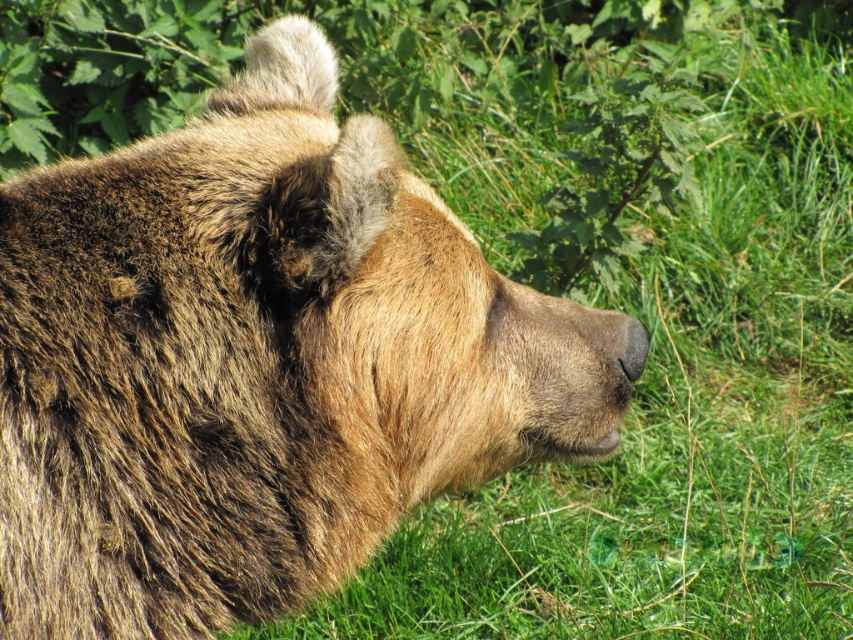
You are a photographer aiming to capture the bear in the scene. You want to ensure that both the green leafy plant at upper center and the black fur nose at center are visible in your shot. Based on their positions, which object should you position first in your camera frame to include both?

The green leafy plant at upper center is to the right of the black fur nose at center, so you should position the black fur nose at center first on the left side of the frame to ensure the green leafy plant at upper center fits on the right.

You are a wildlife photographer aiming to capture a close shot of the fuzzy brown bear at center. If your camera has a focus point at the center of the image, which is at coordinate point 0.5, 0.5, will the bear be in focus?

The fuzzy brown bear at center is located at point (257, 362), which is slightly to the right and above the camera focus point at (426, 320). Therefore, the bear will not be perfectly centered in the frame, so it may not be in focus unless the focus point is adjusted.

Based on the scene description, which object is taller between the fuzzy brown bear at center and the green leafy plant at upper center?

The fuzzy brown bear at center is taller than the green leafy plant at upper center according to the description.